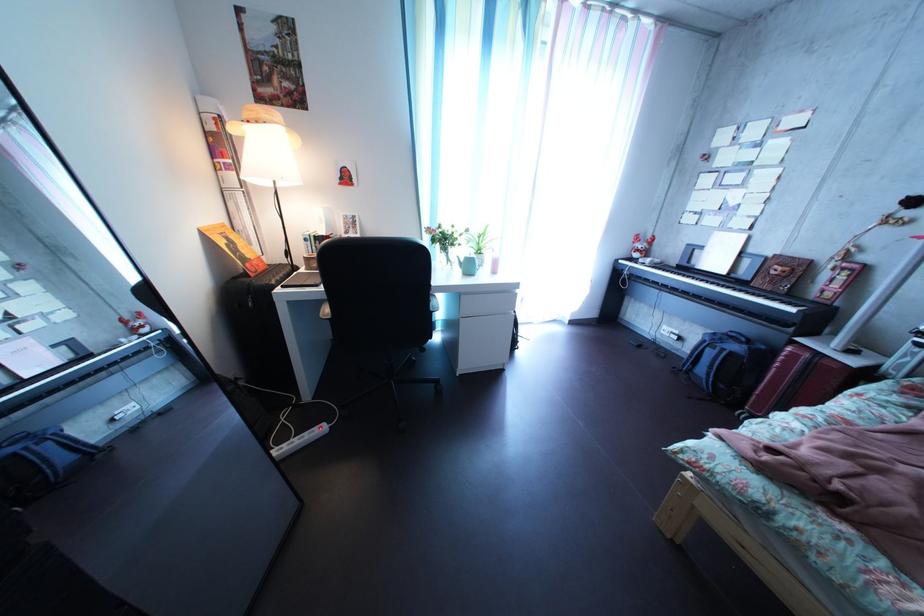
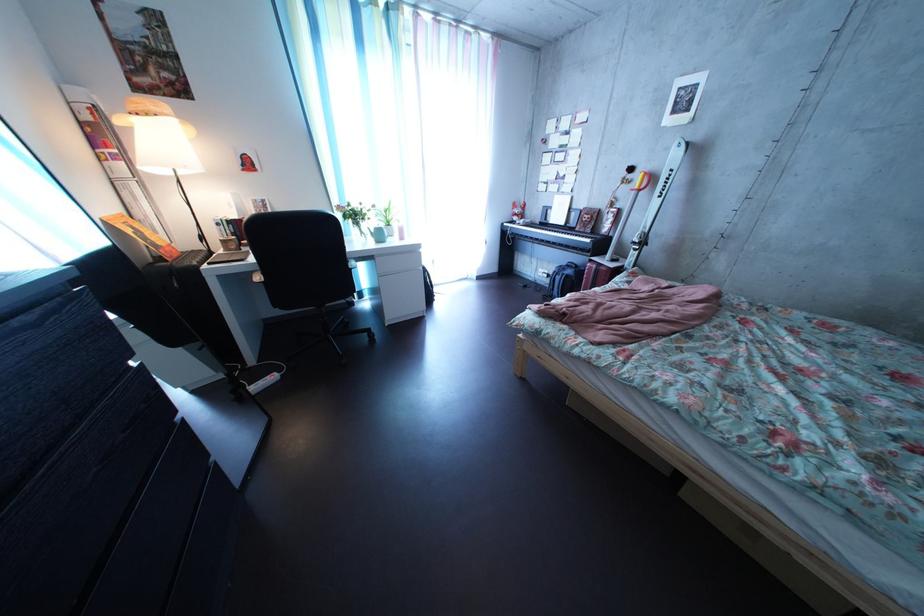
Find the pixel in the second image that matches (737,281) in the first image.

(577, 232)